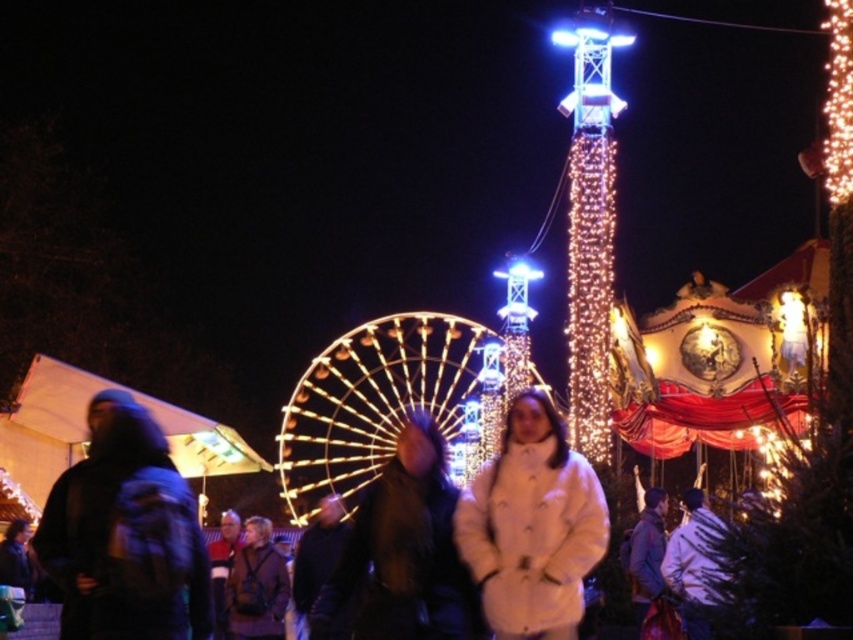
Who is lower down, white fluffy coat at center or illuminated string lights at upper right?

white fluffy coat at center is below.

Is point (546, 554) closer to viewer compared to point (851, 186)?

Yes.

Describe the element at coordinates (532, 525) in the screenshot. Image resolution: width=853 pixels, height=640 pixels. I see `white fluffy coat at center` at that location.

Find the location of a particular element. The image size is (853, 640). white fluffy coat at center is located at coordinates (532, 525).

Does illuminated wireframe structure at upper center appear over illuminated string lights at upper right?

No.

Looking at this image, how much distance is there between illuminated wireframe structure at upper center and illuminated string lights at upper right?

The distance of illuminated wireframe structure at upper center from illuminated string lights at upper right is 26.85 meters.

At what (x,y) coordinates should I click in order to perform the action: click on illuminated wireframe structure at upper center. Please return your answer as a coordinate pair (x, y). This screenshot has height=640, width=853. Looking at the image, I should click on (590, 221).

Between white fluffy coat at center and illuminated wireframe structure at upper center, which one has more height?

Standing taller between the two is illuminated wireframe structure at upper center.

Is white fluffy coat at center further to the viewer compared to illuminated wireframe structure at upper center?

No, it is in front of illuminated wireframe structure at upper center.

The width and height of the screenshot is (853, 640). In order to click on white fluffy coat at center in this screenshot , I will do `click(532, 525)`.

Locate an element on the screen. This screenshot has width=853, height=640. white fluffy coat at center is located at coordinates (532, 525).